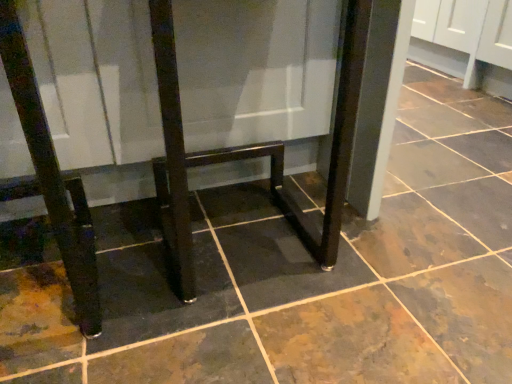
Find the location of `free space in front of glossy dark wood table at center, which appears as the first furniture when viewed from the right`. free space in front of glossy dark wood table at center, which appears as the first furniture when viewed from the right is located at coordinates 250,335.